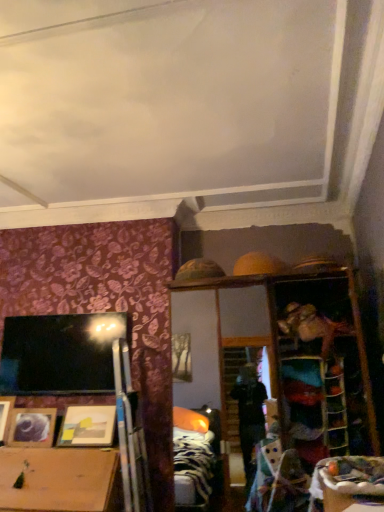
What is the approximate width of matte wooden picture frame at lower left, arranged as the 3th picture frame when viewed from the left?

It is 8.19 inches.

In order to face matte wooden picture frame at lower left, arranged as the second picture frame when viewed from the right, should I rotate leftwards or rightwards?

It's best to rotate left around 20.515 degrees.

The image size is (384, 512). Describe the element at coordinates (5, 416) in the screenshot. I see `wooden picture frame at lower left, arranged as the third picture frame when viewed from the right` at that location.

Describe the element at coordinates (347, 483) in the screenshot. The image size is (384, 512). I see `wooden table at lower right` at that location.

Where is `matte wooden picture frame at lower left, arranged as the first picture frame when viewed from the right`? The width and height of the screenshot is (384, 512). matte wooden picture frame at lower left, arranged as the first picture frame when viewed from the right is located at coordinates (88, 426).

I want to click on table above the matte wooden picture frame at lower left, arranged as the 3th picture frame when viewed from the left (from a real-world perspective), so tap(347, 483).

In the scene shown: Looking at their sizes, would you say wooden table at lower right is wider or thinner than matte wooden picture frame at lower left, arranged as the first picture frame when viewed from the right?

In the image, wooden table at lower right appears to be wider than matte wooden picture frame at lower left, arranged as the first picture frame when viewed from the right.

From the image's perspective, which is above, wooden table at lower right or matte wooden picture frame at lower left, arranged as the first picture frame when viewed from the right?

wooden table at lower right is shown above in the image.

Can you tell me how much wooden table at lower right and matte wooden picture frame at lower left, arranged as the first picture frame when viewed from the right, differ in facing direction?

They differ by 99.7 degrees in their facing directions.

Find the location of a particular element. The image size is (384, 512). picture frame that is the 2nd one above the matte wooden picture frame at lower left, arranged as the second picture frame when viewed from the right (from a real-world perspective) is located at coordinates click(x=5, y=416).

Measure the distance from matte wooden picture frame at lower left, which ranks as the second picture frame in left-to-right order, to wooden picture frame at lower left, arranged as the third picture frame when viewed from the right.

matte wooden picture frame at lower left, which ranks as the second picture frame in left-to-right order, and wooden picture frame at lower left, arranged as the third picture frame when viewed from the right, are 16.93 centimeters apart from each other.

From a real-world perspective, is matte wooden picture frame at lower left, arranged as the second picture frame when viewed from the right, on wooden picture frame at lower left, positioned as the first picture frame in left-to-right order?

No, from a real-world perspective, matte wooden picture frame at lower left, arranged as the second picture frame when viewed from the right, is not over wooden picture frame at lower left, positioned as the first picture frame in left-to-right order

Considering the points (34, 437) and (5, 408), which point is behind, point (34, 437) or point (5, 408)?

The point (5, 408) is behind.

You are a GUI agent. You are given a task and a screenshot of the screen. Output one action in this format:
    pyautogui.click(x=<x>, y=<y>)
    Task: Click on the table that is on the right side of matte wooden picture frame at lower left, which ranks as the second picture frame in left-to-right order
    This screenshot has height=512, width=384.
    Given the screenshot: What is the action you would take?
    pyautogui.click(x=347, y=483)

Which object is wider, wooden table at lower right or matte wooden picture frame at lower left, arranged as the second picture frame when viewed from the right?

wooden table at lower right.

Considering the positions of objects wooden table at lower right and matte wooden picture frame at lower left, which ranks as the second picture frame in left-to-right order, in the image provided, who is more to the right, wooden table at lower right or matte wooden picture frame at lower left, which ranks as the second picture frame in left-to-right order,?

Positioned to the right is wooden table at lower right.

Considering the positions of objects wooden table at lower right and matte wooden picture frame at lower left, which ranks as the second picture frame in left-to-right order, in the image provided, who is behind, wooden table at lower right or matte wooden picture frame at lower left, which ranks as the second picture frame in left-to-right order,?

matte wooden picture frame at lower left, which ranks as the second picture frame in left-to-right order, is further from the camera.

Can you confirm if wooden picture frame at lower left, positioned as the first picture frame in left-to-right order, is thinner than matte wooden picture frame at lower left, arranged as the 3th picture frame when viewed from the left?

Indeed, wooden picture frame at lower left, positioned as the first picture frame in left-to-right order, has a lesser width compared to matte wooden picture frame at lower left, arranged as the 3th picture frame when viewed from the left.

Does wooden picture frame at lower left, positioned as the first picture frame in left-to-right order, lie behind matte wooden picture frame at lower left, arranged as the first picture frame when viewed from the right?

That is True.

In the scene shown: What's the angular difference between matte wooden picture frame at lower left, arranged as the second picture frame when viewed from the right, and matte wooden picture frame at lower left, arranged as the 3th picture frame when viewed from the left,'s facing directions?

4.89 degrees separate the facing orientations of matte wooden picture frame at lower left, arranged as the second picture frame when viewed from the right, and matte wooden picture frame at lower left, arranged as the 3th picture frame when viewed from the left.

From the image's perspective, would you say matte wooden picture frame at lower left, arranged as the second picture frame when viewed from the right, is shown under matte wooden picture frame at lower left, arranged as the 3th picture frame when viewed from the left?

Yes, from the image's perspective, matte wooden picture frame at lower left, arranged as the second picture frame when viewed from the right, is below matte wooden picture frame at lower left, arranged as the 3th picture frame when viewed from the left.

In the image, is matte wooden picture frame at lower left, arranged as the second picture frame when viewed from the right, positioned in front of or behind matte wooden picture frame at lower left, arranged as the first picture frame when viewed from the right?

Clearly, matte wooden picture frame at lower left, arranged as the second picture frame when viewed from the right, is behind matte wooden picture frame at lower left, arranged as the first picture frame when viewed from the right.

Is matte wooden picture frame at lower left, arranged as the second picture frame when viewed from the right, inside or outside of matte wooden picture frame at lower left, arranged as the 3th picture frame when viewed from the left?

matte wooden picture frame at lower left, arranged as the second picture frame when viewed from the right, lies outside matte wooden picture frame at lower left, arranged as the 3th picture frame when viewed from the left.

Considering the relative sizes of wooden picture frame at lower left, positioned as the first picture frame in left-to-right order, and wooden table at lower right in the image provided, is wooden picture frame at lower left, positioned as the first picture frame in left-to-right order, shorter than wooden table at lower right?

In fact, wooden picture frame at lower left, positioned as the first picture frame in left-to-right order, may be taller than wooden table at lower right.

Can you confirm if wooden picture frame at lower left, positioned as the first picture frame in left-to-right order, is thinner than wooden table at lower right?

Yes, wooden picture frame at lower left, positioned as the first picture frame in left-to-right order, is thinner than wooden table at lower right.

Relative to wooden table at lower right, is wooden picture frame at lower left, positioned as the first picture frame in left-to-right order, in front or behind?

wooden picture frame at lower left, positioned as the first picture frame in left-to-right order, is positioned farther from the viewer than wooden table at lower right.

From the image's perspective, which is above, wooden picture frame at lower left, arranged as the third picture frame when viewed from the right, or wooden table at lower right?

wooden table at lower right is shown above in the image.

Considering the positions of objects matte wooden picture frame at lower left, arranged as the 3th picture frame when viewed from the left, and wooden picture frame at lower left, positioned as the first picture frame in left-to-right order, in the image provided, who is more to the right, matte wooden picture frame at lower left, arranged as the 3th picture frame when viewed from the left, or wooden picture frame at lower left, positioned as the first picture frame in left-to-right order,?

From the viewer's perspective, matte wooden picture frame at lower left, arranged as the 3th picture frame when viewed from the left, appears more on the right side.

From the image's perspective, is matte wooden picture frame at lower left, arranged as the first picture frame when viewed from the right, positioned above or below wooden picture frame at lower left, positioned as the first picture frame in left-to-right order?

Based on their image positions, matte wooden picture frame at lower left, arranged as the first picture frame when viewed from the right, is located above wooden picture frame at lower left, positioned as the first picture frame in left-to-right order.

From their relative heights in the image, would you say matte wooden picture frame at lower left, arranged as the first picture frame when viewed from the right, is taller or shorter than wooden picture frame at lower left, positioned as the first picture frame in left-to-right order?

Clearly, matte wooden picture frame at lower left, arranged as the first picture frame when viewed from the right, is shorter compared to wooden picture frame at lower left, positioned as the first picture frame in left-to-right order.

Starting from the wooden table at lower right, which picture frame is the 1st one behind? Please provide its 2D coordinates.

[(88, 426)]

Locate an element on the screen. Image resolution: width=384 pixels, height=512 pixels. the 2nd picture frame above the matte wooden picture frame at lower left, arranged as the second picture frame when viewed from the right (from a real-world perspective) is located at coordinates (5, 416).

When comparing their distances from matte wooden picture frame at lower left, arranged as the 3th picture frame when viewed from the left, does wooden picture frame at lower left, positioned as the first picture frame in left-to-right order, or wooden table at lower right seem further?

wooden table at lower right is further to matte wooden picture frame at lower left, arranged as the 3th picture frame when viewed from the left.

From the image, which object appears to be nearer to matte wooden picture frame at lower left, arranged as the 3th picture frame when viewed from the left, wooden picture frame at lower left, positioned as the first picture frame in left-to-right order, or matte wooden picture frame at lower left, which ranks as the second picture frame in left-to-right order?

Among the two, matte wooden picture frame at lower left, which ranks as the second picture frame in left-to-right order, is located nearer to matte wooden picture frame at lower left, arranged as the 3th picture frame when viewed from the left.

From the image, which object appears to be nearer to wooden table at lower right, matte wooden picture frame at lower left, arranged as the second picture frame when viewed from the right, or matte wooden picture frame at lower left, arranged as the 3th picture frame when viewed from the left?

matte wooden picture frame at lower left, arranged as the 3th picture frame when viewed from the left, is closer to wooden table at lower right.

Which object lies nearer to the anchor point matte wooden picture frame at lower left, arranged as the second picture frame when viewed from the right, wooden table at lower right or wooden picture frame at lower left, arranged as the third picture frame when viewed from the right?

Among the two, wooden picture frame at lower left, arranged as the third picture frame when viewed from the right, is located nearer to matte wooden picture frame at lower left, arranged as the second picture frame when viewed from the right.

From the image, which object appears to be nearer to matte wooden picture frame at lower left, arranged as the 3th picture frame when viewed from the left, wooden table at lower right or wooden picture frame at lower left, positioned as the first picture frame in left-to-right order?

The object closer to matte wooden picture frame at lower left, arranged as the 3th picture frame when viewed from the left, is wooden picture frame at lower left, positioned as the first picture frame in left-to-right order.

Considering their positions, is matte wooden picture frame at lower left, arranged as the second picture frame when viewed from the right, positioned closer to wooden picture frame at lower left, arranged as the third picture frame when viewed from the right, than matte wooden picture frame at lower left, arranged as the first picture frame when viewed from the right?

matte wooden picture frame at lower left, arranged as the second picture frame when viewed from the right, is positioned closer to the anchor wooden picture frame at lower left, arranged as the third picture frame when viewed from the right.

Estimate the real-world distances between objects in this image. Which object is further from wooden table at lower right, matte wooden picture frame at lower left, which ranks as the second picture frame in left-to-right order, or wooden picture frame at lower left, positioned as the first picture frame in left-to-right order?

wooden picture frame at lower left, positioned as the first picture frame in left-to-right order, lies further to wooden table at lower right than the other object.

Based on their spatial positions, is matte wooden picture frame at lower left, arranged as the first picture frame when viewed from the right, or wooden picture frame at lower left, positioned as the first picture frame in left-to-right order, further from matte wooden picture frame at lower left, arranged as the second picture frame when viewed from the right?

Among the two, matte wooden picture frame at lower left, arranged as the first picture frame when viewed from the right, is located further to matte wooden picture frame at lower left, arranged as the second picture frame when viewed from the right.

The width and height of the screenshot is (384, 512). I want to click on picture frame between wooden table at lower right and matte wooden picture frame at lower left, arranged as the second picture frame when viewed from the right, from front to back, so click(88, 426).

Identify the location of picture frame between wooden picture frame at lower left, positioned as the first picture frame in left-to-right order, and matte wooden picture frame at lower left, arranged as the first picture frame when viewed from the right. (32, 426).